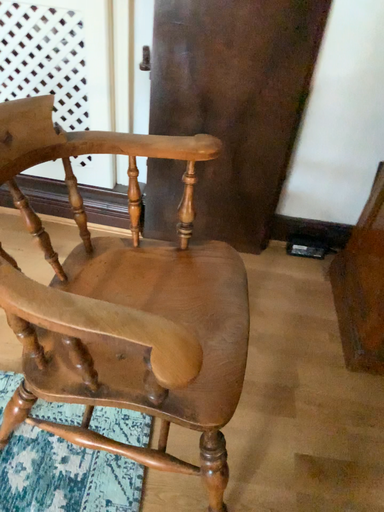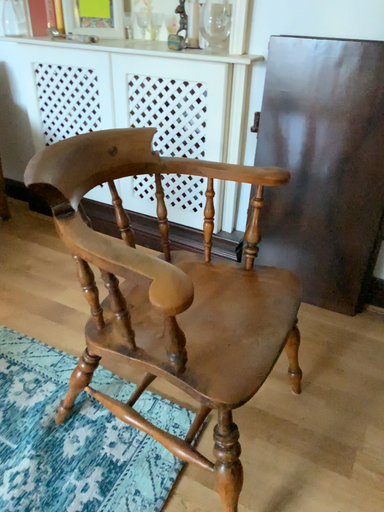
Question: How did the camera likely rotate when shooting the video?

Choices:
 (A) rotated left
 (B) rotated right

Answer: (A)